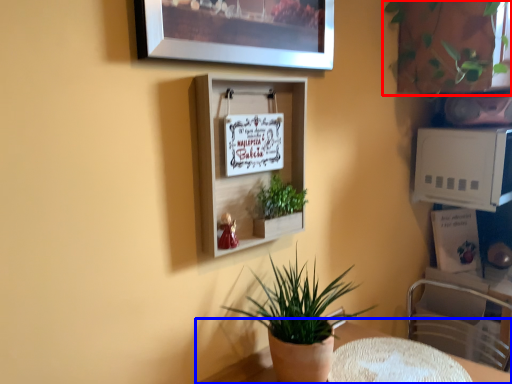
Question: Which object appears closest to the camera in this image, houseplant (highlighted by a red box) or table (highlighted by a blue box)?

Choices:
 (A) houseplant
 (B) table

Answer: (B)